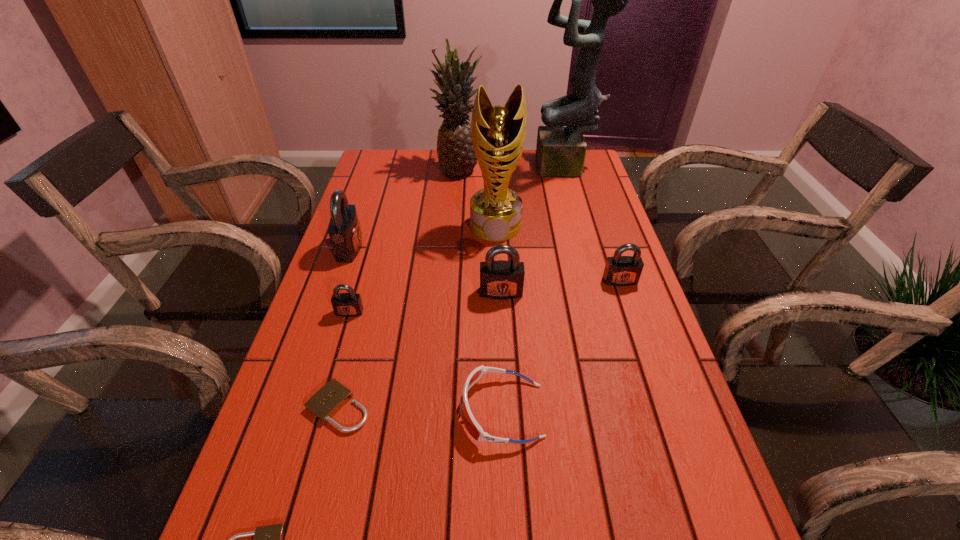
The width and height of the screenshot is (960, 540). In order to click on pineapple at the far edge in this screenshot , I will do `click(456, 156)`.

The image size is (960, 540). I want to click on sculpture located in the right edge section of the desktop, so click(561, 148).

Locate an element on the screen. padlock situated at the right edge is located at coordinates (619, 270).

The image size is (960, 540). Identify the location of object present at the far right corner. (561, 148).

You are a GUI agent. You are given a task and a screenshot of the screen. Output one action in this format:
    pyautogui.click(x=<x>, y=<y>)
    Task: Click on the vacant space at the far edge of the desktop
    
    Given the screenshot: What is the action you would take?
    pyautogui.click(x=537, y=183)

In the image, there is a desktop. At what (x,y) coordinates should I click in order to perform the action: click on free space at the left edge. Please return your answer as a coordinate pair (x, y). The width and height of the screenshot is (960, 540). Looking at the image, I should click on (387, 243).

Identify the location of vacant space at the right edge. Image resolution: width=960 pixels, height=540 pixels. (630, 422).

This screenshot has width=960, height=540. In the image, there is a desktop. Find the location of `vacant space at the far left corner`. vacant space at the far left corner is located at coordinates (405, 166).

This screenshot has width=960, height=540. What are the coordinates of `free space at the far right corner of the desktop` in the screenshot? It's located at (578, 182).

You are a GUI agent. You are given a task and a screenshot of the screen. Output one action in this format:
    pyautogui.click(x=<x>, y=<y>)
    Task: Click on the vacant region between the gold award and the ninth tallest object
    This screenshot has width=960, height=540.
    Given the screenshot: What is the action you would take?
    pyautogui.click(x=417, y=316)